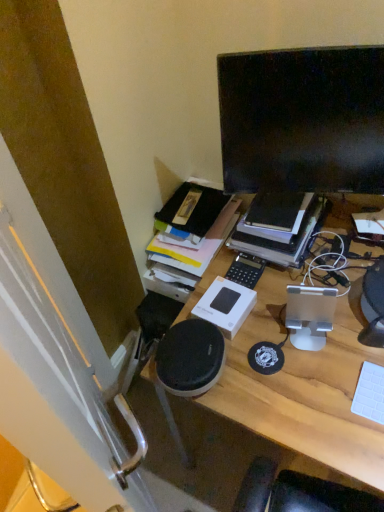
Question: Considering the relative sizes of hardcover book at upper center and wooden desk at center in the image provided, is hardcover book at upper center shorter than wooden desk at center?

Choices:
 (A) yes
 (B) no

Answer: (A)

Question: Is hardcover book at upper center directly adjacent to wooden desk at center?

Choices:
 (A) no
 (B) yes

Answer: (A)

Question: Is hardcover book at upper center not close to wooden desk at center?

Choices:
 (A) no
 (B) yes

Answer: (A)

Question: Is hardcover book at upper center closer to the viewer compared to wooden desk at center?

Choices:
 (A) no
 (B) yes

Answer: (A)

Question: From the image's perspective, is hardcover book at upper center over wooden desk at center?

Choices:
 (A) yes
 (B) no

Answer: (A)

Question: Considering the relative sizes of hardcover book at upper center and wooden desk at center in the image provided, is hardcover book at upper center taller than wooden desk at center?

Choices:
 (A) yes
 (B) no

Answer: (B)

Question: Is black glossy monitor at upper right not close to hardcover book at upper center?

Choices:
 (A) yes
 (B) no

Answer: (B)

Question: Is hardcover book at upper center completely or partially inside black glossy monitor at upper right?

Choices:
 (A) no
 (B) yes

Answer: (A)

Question: Is black glossy monitor at upper right wider than hardcover book at upper center?

Choices:
 (A) yes
 (B) no

Answer: (B)

Question: Considering the relative sizes of black glossy monitor at upper right and hardcover book at upper center in the image provided, is black glossy monitor at upper right smaller than hardcover book at upper center?

Choices:
 (A) no
 (B) yes

Answer: (B)

Question: Does black glossy monitor at upper right have a lesser width compared to hardcover book at upper center?

Choices:
 (A) yes
 (B) no

Answer: (A)

Question: Considering the relative sizes of black glossy monitor at upper right and hardcover book at upper center in the image provided, is black glossy monitor at upper right bigger than hardcover book at upper center?

Choices:
 (A) no
 (B) yes

Answer: (A)

Question: Is black glossy monitor at upper right behind wooden desk at center?

Choices:
 (A) no
 (B) yes

Answer: (B)